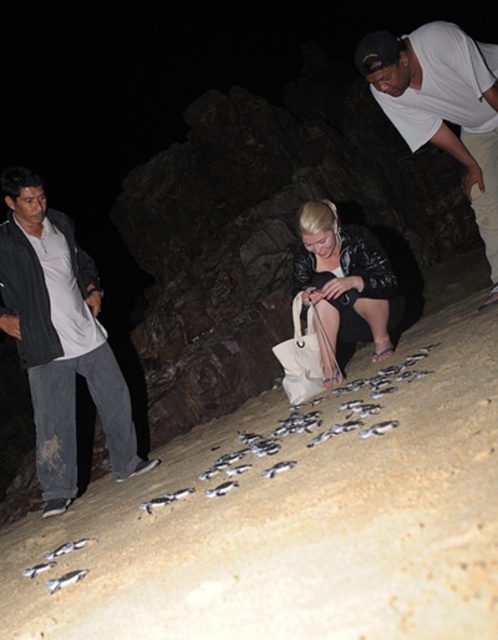
You are a photographer trying to capture the scene of the baby turtles. You have two subjects in the background wearing a white matte shirt at upper right and a black leather jacket at center. Which subject should you focus on if you want to capture a wider portion of the scene in your photo?

The white matte shirt at upper right has a larger width than the black leather jacket at center, so focusing on it would allow you to capture a wider portion of the scene.

You are a photographer trying to capture a photo of the light brown sandy beach at center and the black leather jacket at center in the same frame. Based on their distance, can you fit both into the shot without moving the camera?

The light brown sandy beach at center and black leather jacket at center are 37.36 inches apart. Since they are both centered and close to each other, you can likely fit both into the frame without moving the camera.